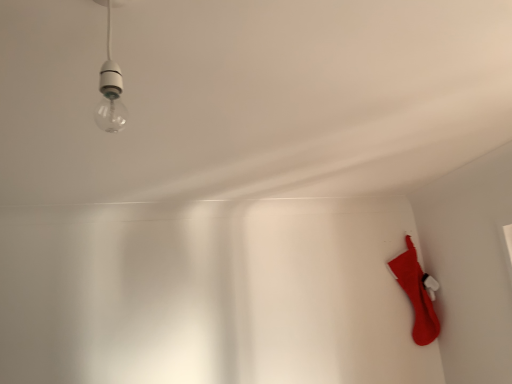
The image size is (512, 384). Describe the element at coordinates (416, 294) in the screenshot. I see `red fabric stocking at lower right` at that location.

In order to face red fabric stocking at lower right, should I rotate leftwards or rightwards?

You should look right and rotate roughly 20.442 degrees.

Where is `red fabric stocking at lower right`? red fabric stocking at lower right is located at coordinates (416, 294).

The image size is (512, 384). Describe the element at coordinates (110, 90) in the screenshot. I see `clear glass bulb at upper left` at that location.

You are a GUI agent. You are given a task and a screenshot of the screen. Output one action in this format:
    pyautogui.click(x=<x>, y=<y>)
    Task: Click on the clear glass bulb at upper left
    This screenshot has height=384, width=512.
    Given the screenshot: What is the action you would take?
    pyautogui.click(x=110, y=90)

You are a GUI agent. You are given a task and a screenshot of the screen. Output one action in this format:
    pyautogui.click(x=<x>, y=<y>)
    Task: Click on the red fabric stocking at lower right
    
    Given the screenshot: What is the action you would take?
    pyautogui.click(x=416, y=294)

In the image, is red fabric stocking at lower right on the left side or the right side of clear glass bulb at upper left?

Clearly, red fabric stocking at lower right is on the right of clear glass bulb at upper left in the image.

In the image, is red fabric stocking at lower right positioned in front of or behind clear glass bulb at upper left?

red fabric stocking at lower right is behind clear glass bulb at upper left.

Is point (416, 276) more distant than point (105, 126)?

Yes, point (416, 276) is farther from viewer.

From the image's perspective, is red fabric stocking at lower right below clear glass bulb at upper left?

Indeed, from the image's perspective, red fabric stocking at lower right is shown beneath clear glass bulb at upper left.

Based on the photo, from a real-world perspective, is red fabric stocking at lower right on clear glass bulb at upper left?

No, from a real-world perspective, red fabric stocking at lower right is not above clear glass bulb at upper left.

Which of these two, red fabric stocking at lower right or clear glass bulb at upper left, is wider?

With larger width is red fabric stocking at lower right.

Is red fabric stocking at lower right taller or shorter than clear glass bulb at upper left?

red fabric stocking at lower right is taller than clear glass bulb at upper left.

Between red fabric stocking at lower right and clear glass bulb at upper left, which one has smaller size?

With smaller size is clear glass bulb at upper left.

Looking at this image, would you say red fabric stocking at lower right contains clear glass bulb at upper left?

Actually, clear glass bulb at upper left is outside red fabric stocking at lower right.

Can you see red fabric stocking at lower right touching clear glass bulb at upper left?

No, red fabric stocking at lower right is not in contact with clear glass bulb at upper left.

Is red fabric stocking at lower right looking in the opposite direction of clear glass bulb at upper left?

red fabric stocking at lower right does not have its back to clear glass bulb at upper left.

Identify the location of sock that is on the right side of clear glass bulb at upper left. (416, 294).

Visually, is clear glass bulb at upper left positioned to the left or to the right of red fabric stocking at lower right?

Based on their positions, clear glass bulb at upper left is located to the left of red fabric stocking at lower right.

Considering the relative positions of clear glass bulb at upper left and red fabric stocking at lower right in the image provided, is clear glass bulb at upper left in front of red fabric stocking at lower right?

Yes, the depth of clear glass bulb at upper left is less than that of red fabric stocking at lower right.

Is point (117, 110) closer to camera compared to point (421, 271)?

That is True.

From the image's perspective, which is above, clear glass bulb at upper left or red fabric stocking at lower right?

clear glass bulb at upper left.

From a real-world perspective, is clear glass bulb at upper left positioned under red fabric stocking at lower right based on gravity?

No, from a real-world perspective, clear glass bulb at upper left is not below red fabric stocking at lower right.

In terms of width, does clear glass bulb at upper left look wider or thinner when compared to red fabric stocking at lower right?

Clearly, clear glass bulb at upper left has less width compared to red fabric stocking at lower right.

In terms of height, does clear glass bulb at upper left look taller or shorter compared to red fabric stocking at lower right?

clear glass bulb at upper left is shorter than red fabric stocking at lower right.

Is clear glass bulb at upper left bigger than red fabric stocking at lower right?

No, clear glass bulb at upper left is not bigger than red fabric stocking at lower right.

Consider the image. Would you say clear glass bulb at upper left contains red fabric stocking at lower right?

That's incorrect, red fabric stocking at lower right is not inside clear glass bulb at upper left.

Is clear glass bulb at upper left next to red fabric stocking at lower right and touching it?

No, clear glass bulb at upper left is not touching red fabric stocking at lower right.

Is clear glass bulb at upper left turned away from red fabric stocking at lower right?

That's not correct — clear glass bulb at upper left is not looking away from red fabric stocking at lower right.

What's the angular difference between clear glass bulb at upper left and red fabric stocking at lower right's facing directions?

The angle between the facing direction of clear glass bulb at upper left and the facing direction of red fabric stocking at lower right is 90.2 degrees.

Based on the photo, how far apart are clear glass bulb at upper left and red fabric stocking at lower right?

clear glass bulb at upper left is 6.55 feet from red fabric stocking at lower right.

The image size is (512, 384). In order to click on lamp that appears above the red fabric stocking at lower right (from a real-world perspective) in this screenshot , I will do `click(110, 90)`.

Find the location of a particular element. lamp to the left of red fabric stocking at lower right is located at coordinates 110,90.

I want to click on sock behind the clear glass bulb at upper left, so click(x=416, y=294).